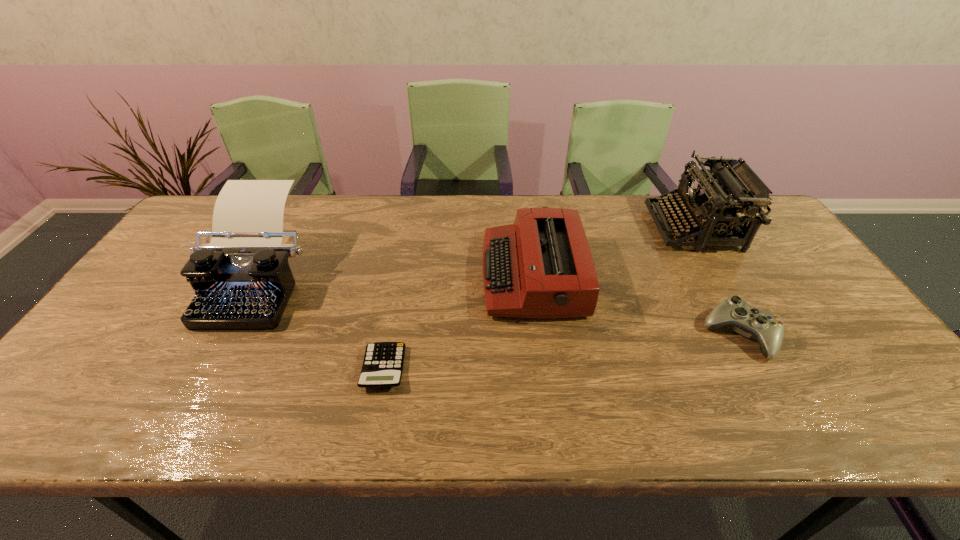
Where is `free space located 0.250m on the keys of the leftmost typewriter`? The width and height of the screenshot is (960, 540). free space located 0.250m on the keys of the leftmost typewriter is located at coordinates (178, 421).

At what (x,y) coordinates should I click in order to perform the action: click on free space located 0.050m on the typing side of the shortest typewriter. Please return your answer as a coordinate pair (x, y). The height and width of the screenshot is (540, 960). Looking at the image, I should click on (466, 275).

Locate an element on the screen. vacant space located on the typing side of the shortest typewriter is located at coordinates (399, 275).

At what (x,y) coordinates should I click in order to perform the action: click on vacant space located 0.380m on the typing side of the shortest typewriter. Please return your answer as a coordinate pair (x, y). Looking at the image, I should click on (350, 275).

Where is `free location located on the front of the fourth tallest object`? free location located on the front of the fourth tallest object is located at coordinates (793, 430).

You are a GUI agent. You are given a task and a screenshot of the screen. Output one action in this format:
    pyautogui.click(x=<x>, y=<y>)
    Task: Click on the free location located 0.230m on the left of the shortest object
    
    Given the screenshot: What is the action you would take?
    pyautogui.click(x=265, y=368)

Find the location of a particular element. This screenshot has width=960, height=540. object situated at the left edge is located at coordinates (242, 280).

You are a GUI agent. You are given a task and a screenshot of the screen. Output one action in this format:
    pyautogui.click(x=<x>, y=<y>)
    Task: Click on the object present at the right edge
    The height and width of the screenshot is (540, 960).
    Given the screenshot: What is the action you would take?
    pyautogui.click(x=731, y=187)

Where is `object that is positioned at the far left corner`? object that is positioned at the far left corner is located at coordinates pyautogui.click(x=242, y=280).

What are the coordinates of `object located in the far right corner section of the desktop` in the screenshot? It's located at (731, 187).